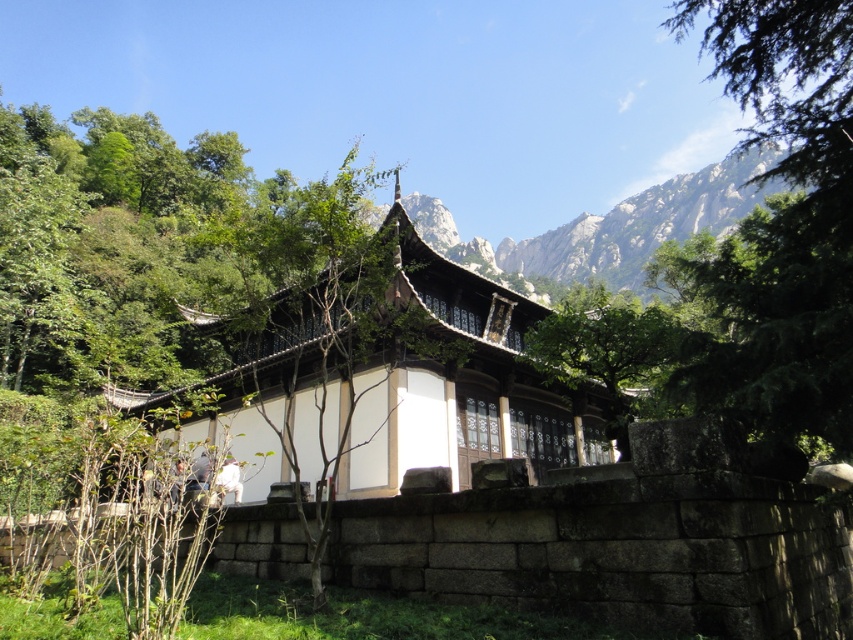
What do you see at coordinates (782, 225) in the screenshot? I see `green leafy tree at upper right` at bounding box center [782, 225].

This screenshot has height=640, width=853. What are the coordinates of `green leafy tree at upper right` in the screenshot? It's located at pyautogui.click(x=782, y=225).

Locate an element on the screen. The width and height of the screenshot is (853, 640). green leafy tree at upper right is located at coordinates (782, 225).